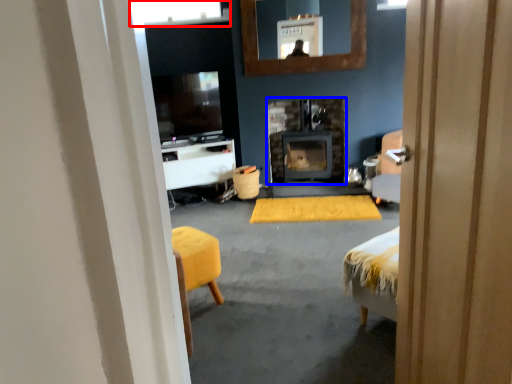
Question: Which object appears closest to the camera in this image, window (highlighted by a red box) or wood burning stove (highlighted by a blue box)?

Choices:
 (A) window
 (B) wood burning stove

Answer: (B)